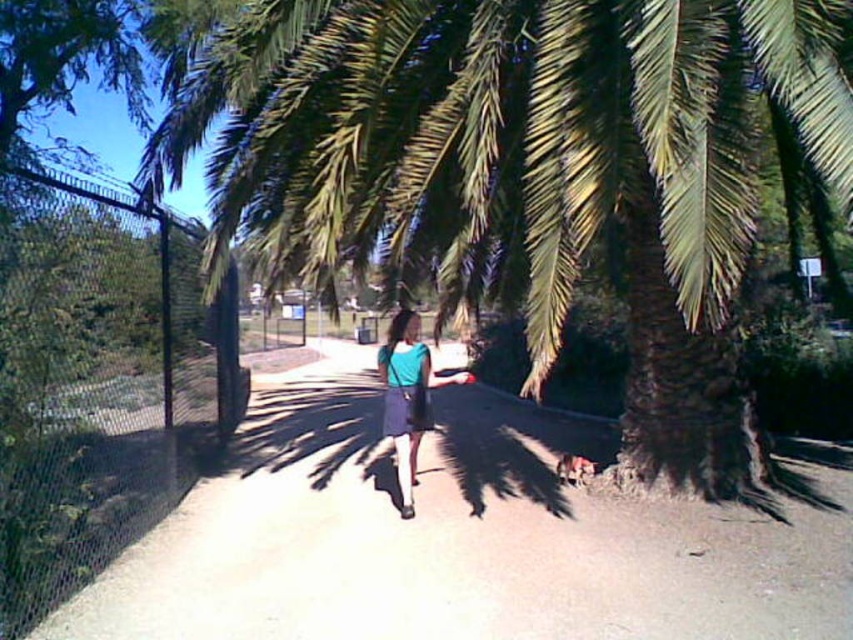
Question: Does black chain-link fence at left appear on the left side of blue fabric skirt at center?

Choices:
 (A) yes
 (B) no

Answer: (A)

Question: Which point is closer to the camera?

Choices:
 (A) blue fabric skirt at center
 (B) green leafy palm tree at center

Answer: (B)

Question: Which of the following is the farthest from the observer?

Choices:
 (A) light brown dirt path at center
 (B) blue fabric skirt at center
 (C) black chain-link fence at left

Answer: (B)

Question: Is green leafy palm tree at center wider than blue fabric skirt at center?

Choices:
 (A) no
 (B) yes

Answer: (B)

Question: Can you confirm if green leafy palm tree at center is positioned above blue fabric skirt at center?

Choices:
 (A) yes
 (B) no

Answer: (A)

Question: Which point is farther from the camera taking this photo?

Choices:
 (A) (529, 298)
 (B) (419, 362)

Answer: (B)